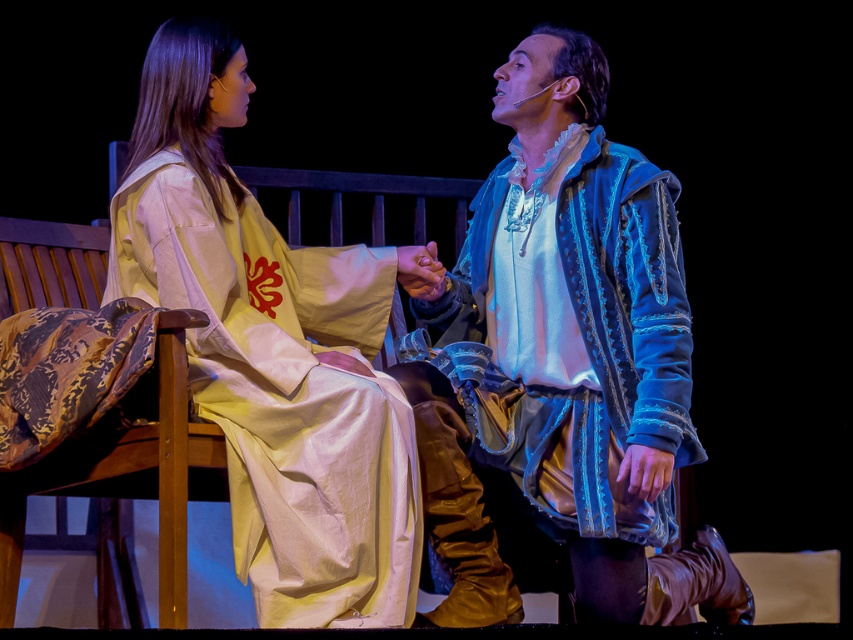
In the scene shown: You are a costume designer preparing for a play. You need to determine which costume requires more fabric based on the provided image. Which one between the blue suede jacket at center and the silk robe at left needs more fabric?

The blue suede jacket at center is larger in size than the silk robe at left, so it requires more fabric.

You are a costume designer analyzing the theatrical scene. You need to determine the spatial relationship between the blue suede jacket at center and the silk robe at left. Which object is positioned lower in the image?

The blue suede jacket at center is positioned below the silk robe at left, so it is lower in the image.